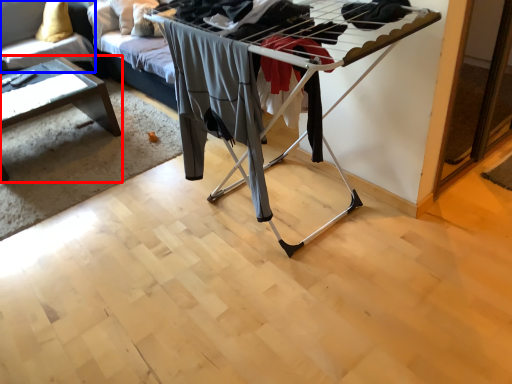
Question: Which object is further to the camera taking this photo, table (highlighted by a red box) or couch (highlighted by a blue box)?

Choices:
 (A) table
 (B) couch

Answer: (B)